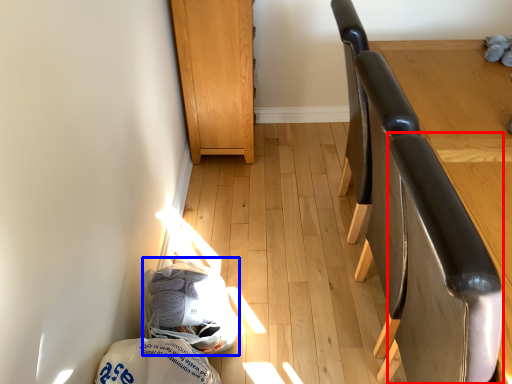
Question: Which point is further to the camera, swivel chair (highlighted by a red box) or material (highlighted by a blue box)?

Choices:
 (A) swivel chair
 (B) material

Answer: (B)